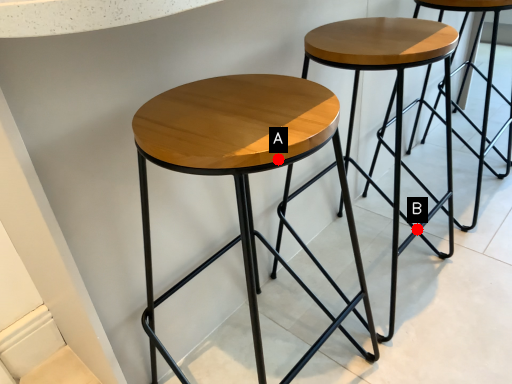
Question: Two points are circled on the image, labeled by A and B beside each circle. Which of the following is the closest to the observer?

Choices:
 (A) A is closer
 (B) B is closer

Answer: (A)